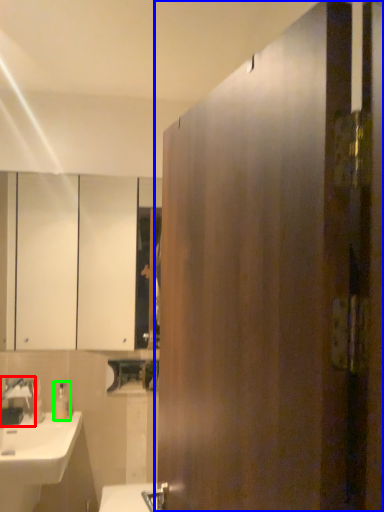
Question: Based on their relative distances, which object is nearer to tap (highlighted by a red box)? Choose from door (highlighted by a blue box) and soap dispenser (highlighted by a green box).

Choices:
 (A) door
 (B) soap dispenser

Answer: (B)